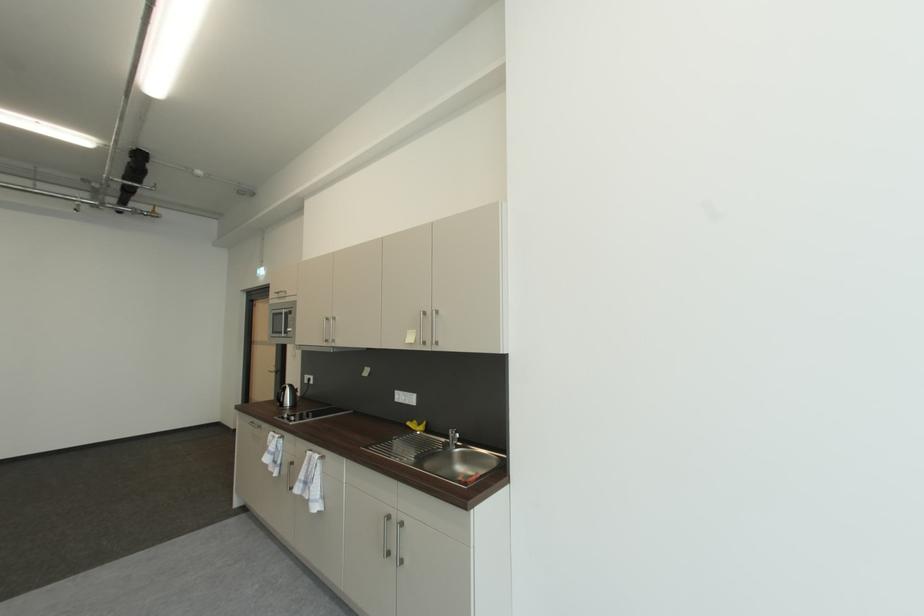
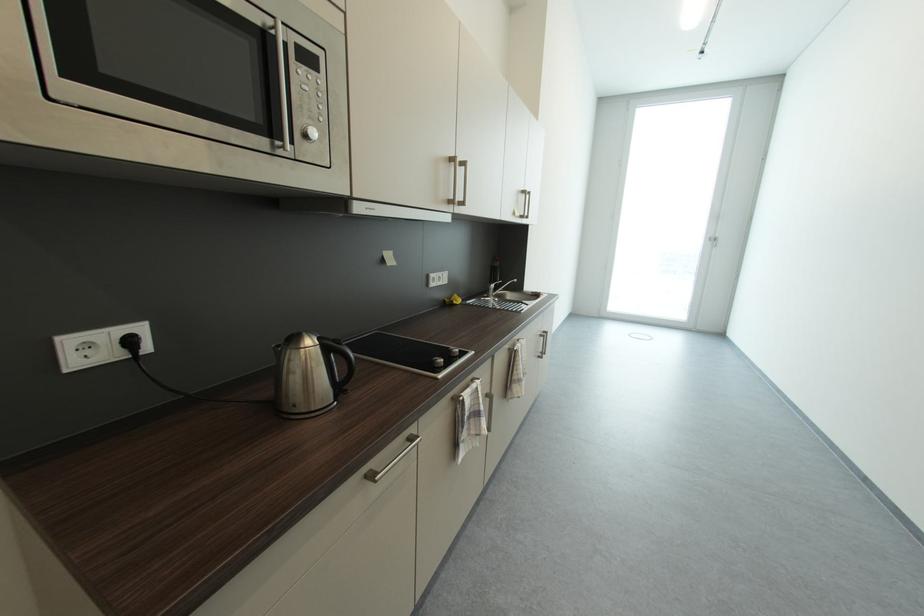
Where in the second image is the point corresponding to [274,446] from the first image?

(472, 419)